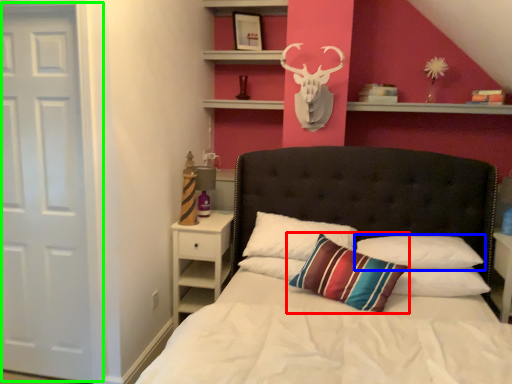
Question: Considering the real-world distances, which object is closest to pillow (highlighted by a red box)? pillow (highlighted by a blue box) or door (highlighted by a green box).

Choices:
 (A) pillow
 (B) door

Answer: (A)